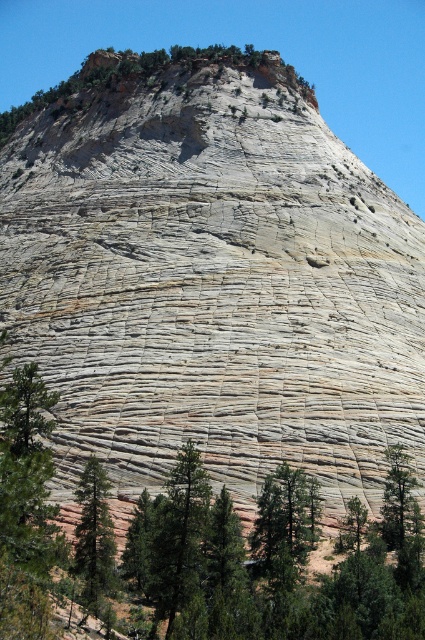
You are a hiker standing at the base of the rock formation and want to take a photo of both the green matte tree at lower left and the green textured tree at lower right. Which tree should you move closer to in order to capture both in the same frame without zooming in?

You should move closer to the green textured tree at lower right because it is smaller in width compared to the green matte tree at lower left, allowing both trees to fit within the frame when positioned closer to the narrower tree.

In the scene shown: You are standing at the base of the rock formation and see the green matte tree at lower left and the green textured tree at lower right. Which tree is closer to your left side?

The green matte tree at lower left is closer to your left side as it is positioned to the left of the green textured tree at lower right.